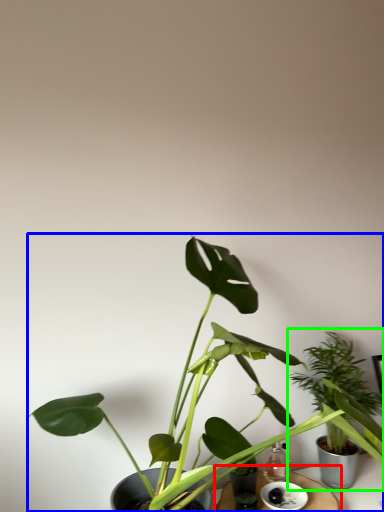
Question: Which is nearer to the table (highlighted by a red box)? houseplant (highlighted by a blue box) or houseplant (highlighted by a green box).

Choices:
 (A) houseplant
 (B) houseplant

Answer: (B)